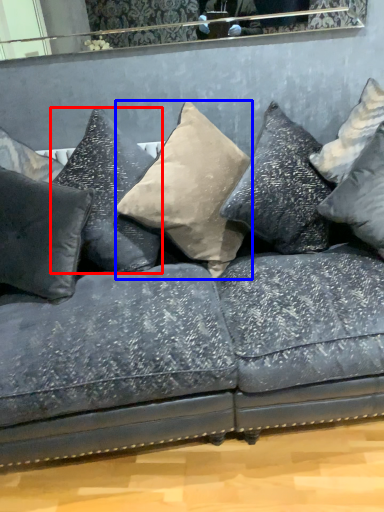
Question: Which object appears closest to the camera in this image, pillow (highlighted by a red box) or pillow (highlighted by a blue box)?

Choices:
 (A) pillow
 (B) pillow

Answer: (B)